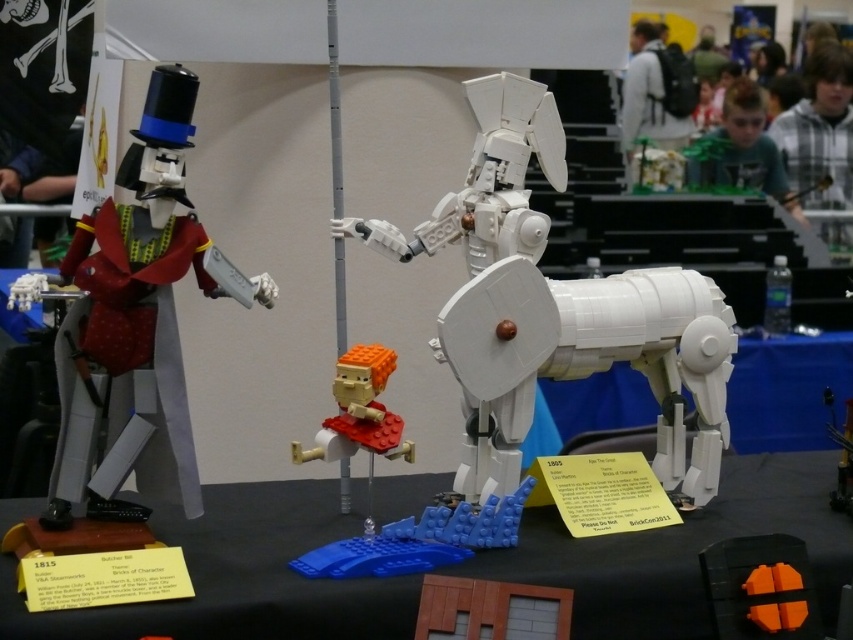
You are an event organizer at the LEGO exhibition and need to rearrange the display. You want to place a new decorative element between the matte black figure at left and the translucent orange plastic figure at center. Based on their current positions, where should you place the new element to maintain symmetry between the two figures?

The new decorative element should be placed between the matte black figure at left and the translucent orange plastic figure at center, centered exactly in the middle to maintain symmetry between their positions.

You are a guest at the LEGO exhibition and notice the matte black figure at left and the translucent orange plastic figure at center. From your perspective, which of these two figures is positioned higher in the image?

The matte black figure at left is above the translucent orange plastic figure at center, so it is positioned higher.

You are at a LEGO exhibition and want to place a small LEGO brick on the black plastic table at center. However, you notice the translucent orange plastic figure at center is in the way. Can you place the brick on the table without moving the figure?

The black plastic table at center is in front of the translucent orange plastic figure at center, so you can place the brick on the table without moving the figure because the table is positioned in front of the figure and not obstructed by it.